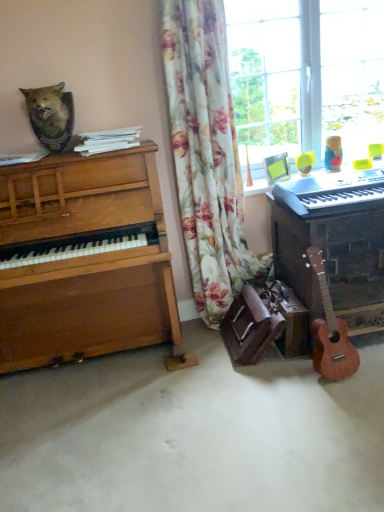
Locate an element on the screen. wooden piano at right, the 1th piano viewed from the right is located at coordinates (333, 242).

The height and width of the screenshot is (512, 384). Describe the element at coordinates (86, 261) in the screenshot. I see `wooden piano at left, the 2th piano positioned from the right` at that location.

You are a GUI agent. You are given a task and a screenshot of the screen. Output one action in this format:
    pyautogui.click(x=<x>, y=<y>)
    Task: Click on the wooden piano at left, the first piano positioned from the left
    This screenshot has height=512, width=384.
    Given the screenshot: What is the action you would take?
    tap(86, 261)

You are a GUI agent. You are given a task and a screenshot of the screen. Output one action in this format:
    pyautogui.click(x=<x>, y=<y>)
    Task: Click on the wooden piano at right, the second piano from the left
    The width and height of the screenshot is (384, 512).
    Given the screenshot: What is the action you would take?
    pyautogui.click(x=333, y=242)

From a real-world perspective, who is located lower, wooden piano at right, the 1th piano viewed from the right, or floral fabric curtain at center?

From a 3D spatial view, wooden piano at right, the 1th piano viewed from the right, is below.

What's the angular difference between wooden piano at right, the second piano from the left, and floral fabric curtain at center's facing directions?

0.822 degrees.

Choose the correct answer: Is wooden piano at right, the second piano from the left, inside floral fabric curtain at center or outside it?

wooden piano at right, the second piano from the left, cannot be found inside floral fabric curtain at center.

Between point (63, 102) and point (208, 326), which one is positioned behind?

Point (208, 326)

From the image's perspective, relative to floral fabric curtain at center, is rustic wooden plaque at upper left above or below?

From the image's perspective, rustic wooden plaque at upper left appears above floral fabric curtain at center.

Between rustic wooden plaque at upper left and floral fabric curtain at center, which one appears on the left side from the viewer's perspective?

From the viewer's perspective, rustic wooden plaque at upper left appears more on the left side.

Who is taller, rustic wooden plaque at upper left or floral fabric curtain at center?

floral fabric curtain at center is taller.

Could you tell me if rustic wooden plaque at upper left is facing wooden piano at right, the second piano from the left?

No, rustic wooden plaque at upper left is not facing towards wooden piano at right, the second piano from the left.

At what (x,y) coordinates should I click in order to perform the action: click on animal positioned vertically above the wooden piano at right, the second piano from the left (from a real-world perspective). Please return your answer as a coordinate pair (x, y). This screenshot has height=512, width=384. Looking at the image, I should click on (50, 115).

Considering the relative sizes of rustic wooden plaque at upper left and wooden piano at right, the 1th piano viewed from the right, in the image provided, is rustic wooden plaque at upper left shorter than wooden piano at right, the 1th piano viewed from the right,?

Indeed, rustic wooden plaque at upper left has a lesser height compared to wooden piano at right, the 1th piano viewed from the right.

What's the angular difference between floral fabric curtain at center and rustic wooden plaque at upper left's facing directions?

There is a 3.38-degree angle between the facing directions of floral fabric curtain at center and rustic wooden plaque at upper left.

Could you tell me if floral fabric curtain at center is facing rustic wooden plaque at upper left?

No, floral fabric curtain at center is not aimed at rustic wooden plaque at upper left.

From the image's perspective, does floral fabric curtain at center appear lower than rustic wooden plaque at upper left?

Yes, from the image's perspective, floral fabric curtain at center is beneath rustic wooden plaque at upper left.

Is floral fabric curtain at center outside of rustic wooden plaque at upper left?

Yes.

Consider the image. Does floral fabric curtain at center lie behind wooden piano at right, the second piano from the left?

No.

From a real-world perspective, is floral fabric curtain at center positioned above or below wooden piano at right, the 1th piano viewed from the right?

floral fabric curtain at center is above wooden piano at right, the 1th piano viewed from the right.

This screenshot has width=384, height=512. Find the location of `curtain that appears in front of the wooden piano at right, the 1th piano viewed from the right`. curtain that appears in front of the wooden piano at right, the 1th piano viewed from the right is located at coordinates (206, 154).

What's the angular difference between floral fabric curtain at center and wooden piano at right, the 1th piano viewed from the right,'s facing directions?

The facing directions of floral fabric curtain at center and wooden piano at right, the 1th piano viewed from the right, are 0.822 degrees apart.

From the image's perspective, which is above, wooden piano at left, the first piano positioned from the left, or light brown wood guitar at lower right?

wooden piano at left, the first piano positioned from the left, is shown above in the image.

Is wooden piano at left, the 2th piano positioned from the right, positioned with its back to light brown wood guitar at lower right?

wooden piano at left, the 2th piano positioned from the right, is not turned away from light brown wood guitar at lower right.

Is point (167, 312) closer to viewer compared to point (318, 262)?

No, (167, 312) is behind (318, 262).

Does wooden piano at left, the 2th piano positioned from the right, touch light brown wood guitar at lower right?

wooden piano at left, the 2th piano positioned from the right, and light brown wood guitar at lower right are clearly separated.

Which is behind, light brown wood guitar at lower right or white plastic keyboard at right?

light brown wood guitar at lower right is more distant.

Would you consider light brown wood guitar at lower right to be distant from white plastic keyboard at right?

No.

From the image's perspective, relative to white plastic keyboard at right, is light brown wood guitar at lower right above or below?

Based on their image positions, light brown wood guitar at lower right is located beneath white plastic keyboard at right.

From a real-world perspective, which is physically below, light brown wood guitar at lower right or white plastic keyboard at right?

In real-world perspective, light brown wood guitar at lower right is lower.

Where is `piano that is the 1st one when counting downward from the floral fabric curtain at center (from the image's perspective)`? piano that is the 1st one when counting downward from the floral fabric curtain at center (from the image's perspective) is located at coordinates (333, 242).

At what (x,y) coordinates should I click in order to perform the action: click on animal above the floral fabric curtain at center (from the image's perspective). Please return your answer as a coordinate pair (x, y). The height and width of the screenshot is (512, 384). Looking at the image, I should click on (50, 115).

Considering their positions, is wooden piano at left, the first piano positioned from the left, positioned closer to wooden piano at right, the 1th piano viewed from the right, than white plastic keyboard at right?

white plastic keyboard at right is positioned closer to the anchor wooden piano at right, the 1th piano viewed from the right.

In the scene shown: Based on their spatial positions, is wooden piano at left, the first piano positioned from the left, or white plastic keyboard at right further from rustic wooden plaque at upper left?

Among the two, white plastic keyboard at right is located further to rustic wooden plaque at upper left.

When comparing their distances from wooden piano at left, the 2th piano positioned from the right, does light brown wood guitar at lower right or wooden piano at right, the second piano from the left, seem further?

light brown wood guitar at lower right is positioned further to the anchor wooden piano at left, the 2th piano positioned from the right.

Based on their spatial positions, is light brown wood guitar at lower right or wooden piano at left, the 2th piano positioned from the right, closer to white plastic keyboard at right?

light brown wood guitar at lower right.

Considering their positions, is wooden piano at left, the first piano positioned from the left, positioned further to wooden piano at right, the 1th piano viewed from the right, than rustic wooden plaque at upper left?

The object further to wooden piano at right, the 1th piano viewed from the right, is rustic wooden plaque at upper left.

When comparing their distances from rustic wooden plaque at upper left, does light brown wood guitar at lower right or white plastic keyboard at right seem further?

light brown wood guitar at lower right.

From the image, which object appears to be nearer to wooden piano at right, the second piano from the left, white plastic keyboard at right or floral fabric curtain at center?

white plastic keyboard at right is positioned closer to the anchor wooden piano at right, the second piano from the left.

Which object lies nearer to the anchor point white plastic keyboard at right, rustic wooden plaque at upper left or light brown wood guitar at lower right?

light brown wood guitar at lower right lies closer to white plastic keyboard at right than the other object.

This screenshot has width=384, height=512. What are the coordinates of `piano between rustic wooden plaque at upper left and light brown wood guitar at lower right` in the screenshot? It's located at (86, 261).

Identify the location of piano between rustic wooden plaque at upper left and wooden piano at right, the second piano from the left, from left to right. (86, 261).

Locate an element on the screen. piano between rustic wooden plaque at upper left and white plastic keyboard at right in the horizontal direction is located at coordinates (86, 261).

Find the location of a particular element. Image resolution: width=384 pixels, height=512 pixels. musical keyboard located between rustic wooden plaque at upper left and wooden piano at right, the 1th piano viewed from the right, in the left-right direction is located at coordinates (332, 192).